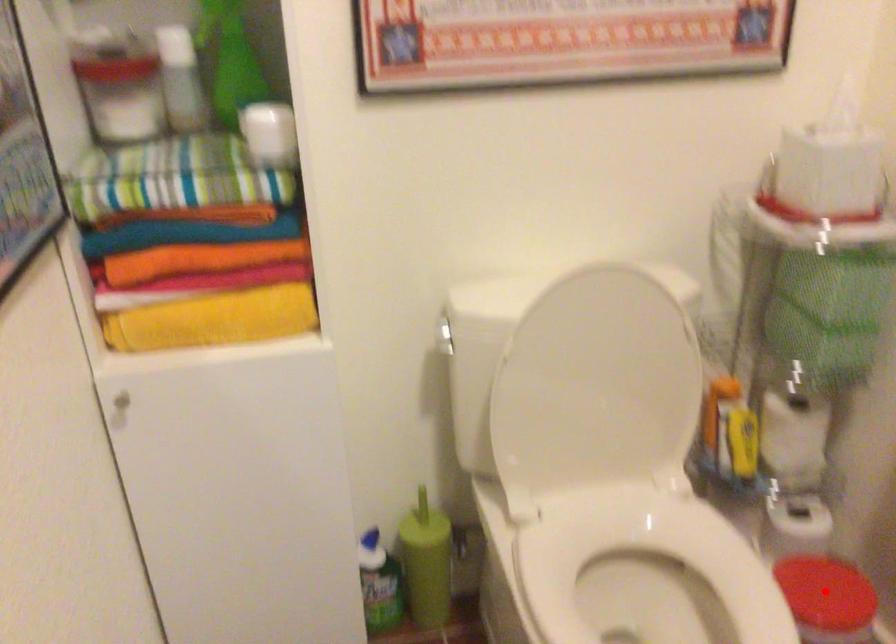
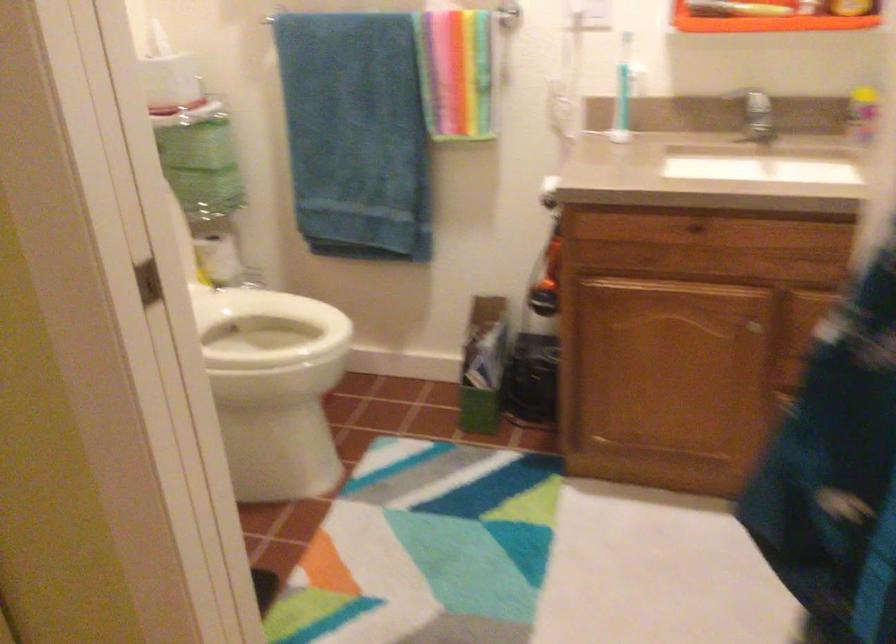
Question: I am providing you with two images of the same scene from different viewpoints. A red point is marked on the first image. Is the red point's position out of view in image 2?

Choices:
 (A) Yes
 (B) No

Answer: (A)